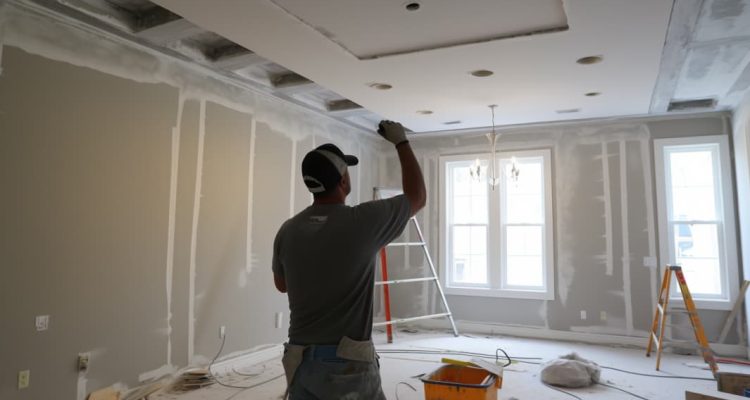
Where is `windows`? The height and width of the screenshot is (400, 750). windows is located at coordinates (469, 205), (519, 190), (700, 178).